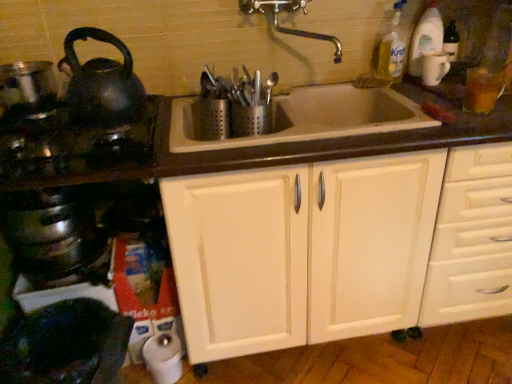
This screenshot has height=384, width=512. Identify the location of blank area to the left of white plastic bottle at upper right, which ranks as the 1th bottle in right-to-left order. (390, 82).